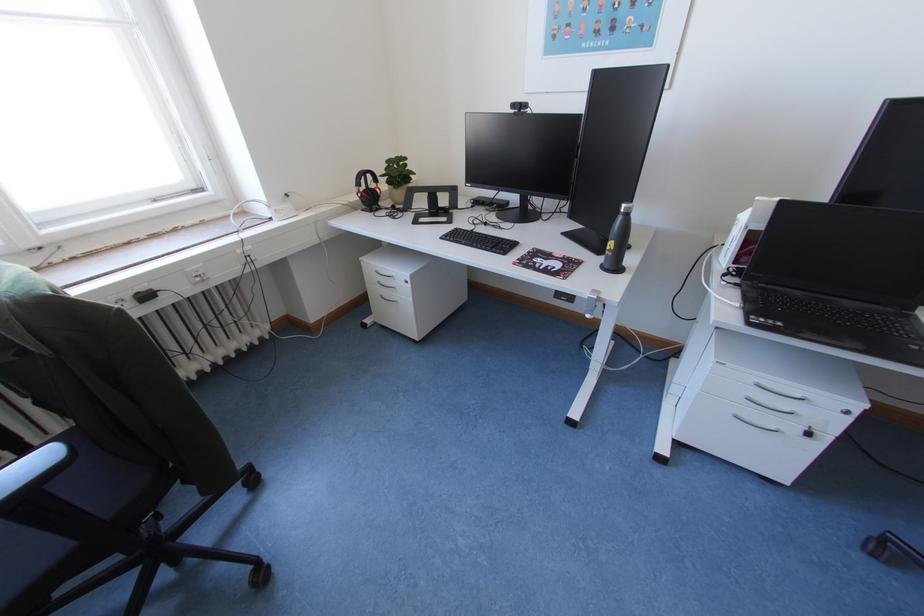
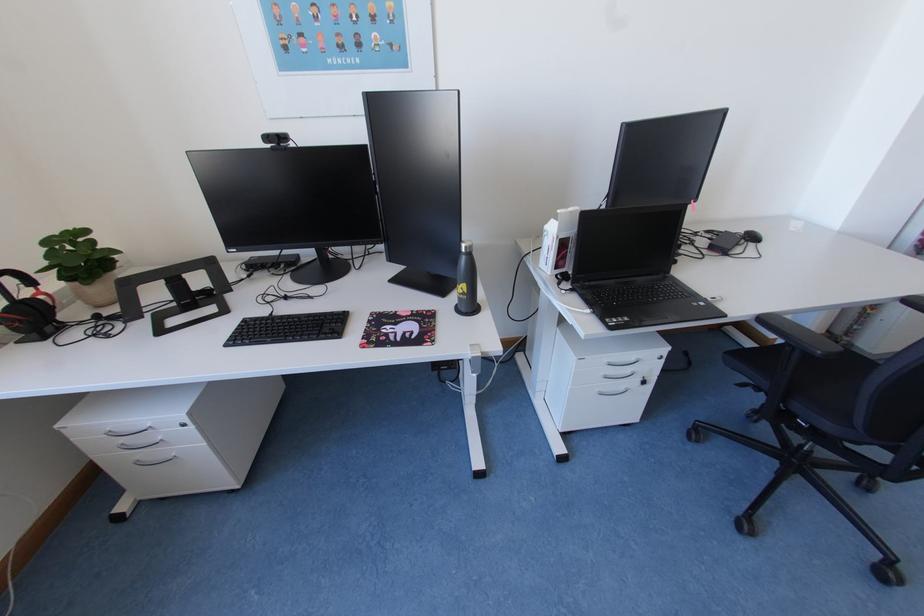
Question: The camera is either moving clockwise (left) or counter-clockwise (right) around the object. The first image is from the beginning of the video and the second image is from the end. Is the camera moving left or right when shooting the video?

Choices:
 (A) Left
 (B) Right

Answer: (A)